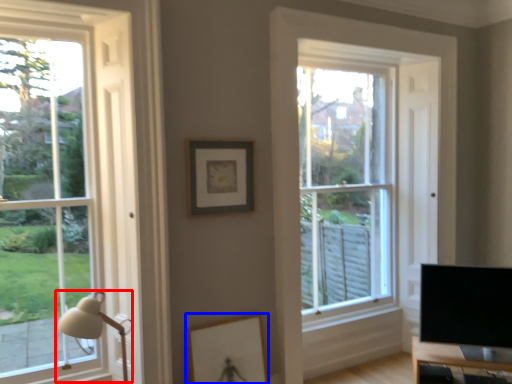
Question: Which object appears closest to the camera in this image, table lamp (highlighted by a red box) or picture frame (highlighted by a blue box)?

Choices:
 (A) table lamp
 (B) picture frame

Answer: (A)